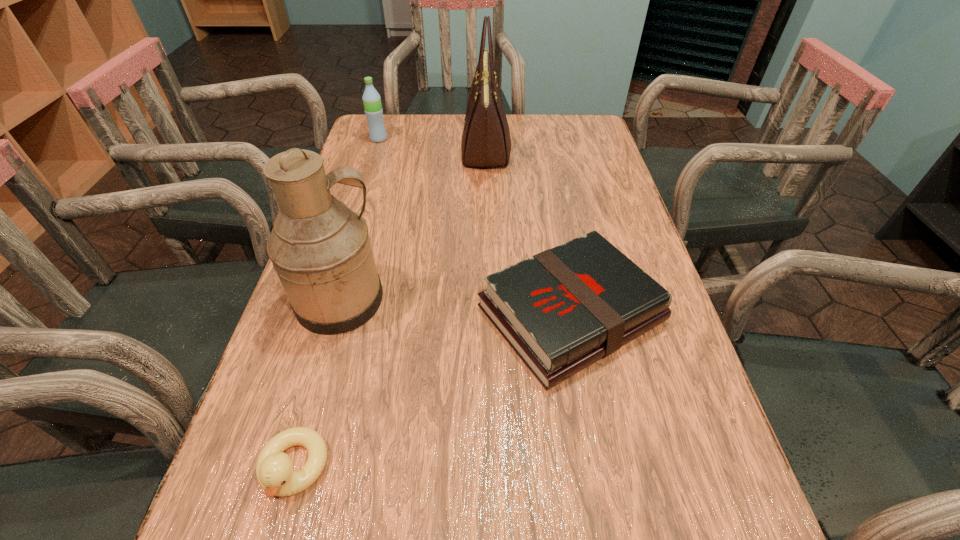
Identify the location of handbag. (486, 143).

Locate an element on the screen. pitcher is located at coordinates (321, 250).

Where is `the third shortest object`? The image size is (960, 540). the third shortest object is located at coordinates (371, 99).

You are a GUI agent. You are given a task and a screenshot of the screen. Output one action in this format:
    pyautogui.click(x=<x>, y=<y>)
    Task: Click on the hardback book
    This screenshot has height=540, width=960.
    Given the screenshot: What is the action you would take?
    pyautogui.click(x=561, y=310)

Find the location of a particular element. the nearest object is located at coordinates (274, 469).

You are a GUI agent. You are given a task and a screenshot of the screen. Output one action in this format:
    pyautogui.click(x=<x>, y=<y>)
    Task: Click on the free space located on the front-facing side of the handbag
    
    Given the screenshot: What is the action you would take?
    pyautogui.click(x=398, y=149)

Where is `vacant space located 0.060m on the front-facing side of the handbag`? vacant space located 0.060m on the front-facing side of the handbag is located at coordinates (442, 149).

Find the location of a particular element. The image size is (960, 540). vacant space positioned 0.290m on the front-facing side of the handbag is located at coordinates (366, 149).

This screenshot has width=960, height=540. Identify the location of blank space located on the front of the pitcher. [312, 402].

Identify the location of free spot located 0.140m on the back of the third shortest object. (387, 114).